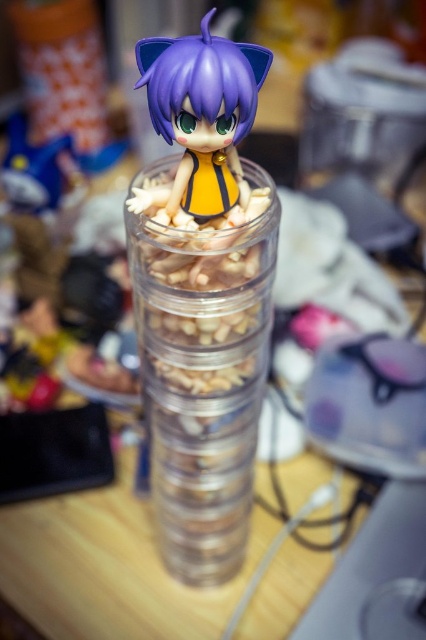
You are organizing your desk and want to place the matte purple figurine at center on top of the transparent plastic container at center. Based on the scene, will the figurine fit stably on top of the container?

The transparent plastic container at center has a greater height compared to matte purple figurine at center, so the figurine will fit stably on top of the container since the container is taller than the figurine.

You are organizing your desk and want to place the matte purple figurine at center on top of the transparent plastic container at center. Considering their sizes, will the figurine fit stably on the container without falling over?

The transparent plastic container at center is wider than the matte purple figurine at center, so the figurine should fit stably on top of the container as its base is larger, providing better support.

You are looking at the image and see two points marked as point 1 and point 2. The first point is at coordinate (189,464) and the second is at (173,138). Based on the scene, which point is closer to you?

Point 1 at coordinate (189,464) is closer to you because it is further to the camera than point 2 at (173,138).